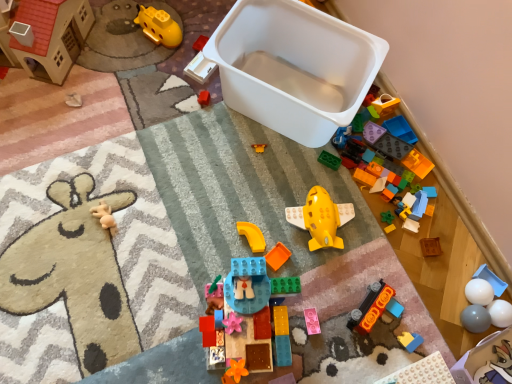
The width and height of the screenshot is (512, 384). Identify the location of free space behind orange matte car at lower right, marked as the 9th toy in a left-to-right arrangement. (366, 257).